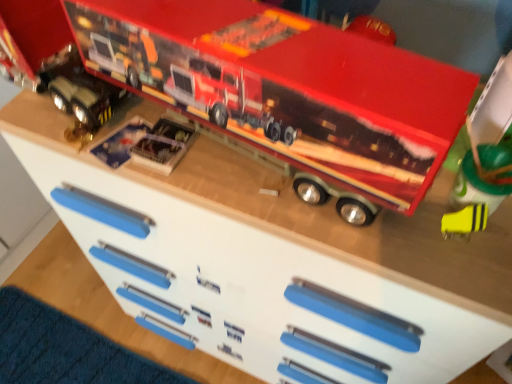
Where is `free spot to the right of metallic silver toy truck at center, positioned as the fourth toy in right-to-left order`? free spot to the right of metallic silver toy truck at center, positioned as the fourth toy in right-to-left order is located at coordinates (234, 188).